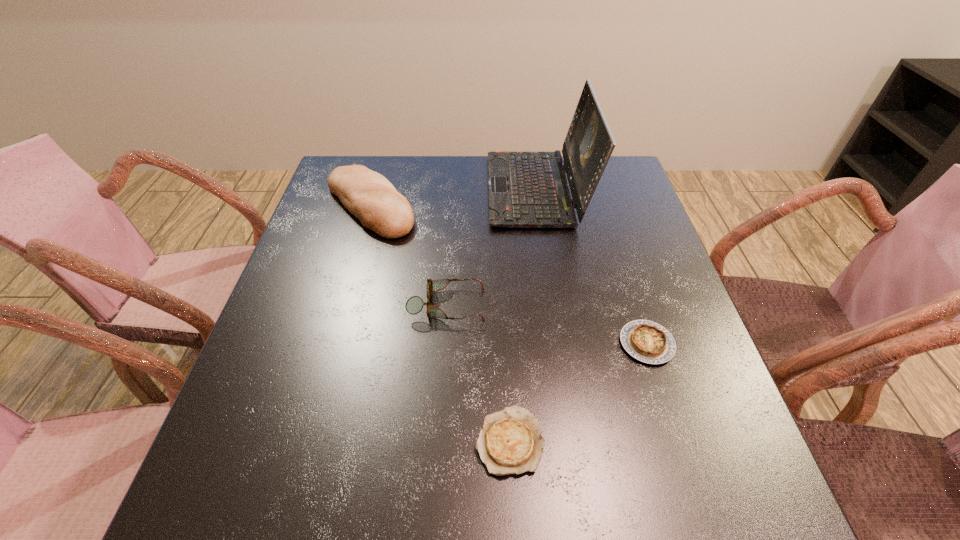
The image size is (960, 540). In order to click on vacant region that satisfies the following two spatial constraints: 1. on the front-facing side of the third tallest object; 2. on the back side of the shorter quiche in this screenshot , I will do `click(438, 441)`.

The width and height of the screenshot is (960, 540). What are the coordinates of `free spot that satisfies the following two spatial constraints: 1. on the screen of the tallest object; 2. on the front side of the shortest object` in the screenshot? It's located at click(x=575, y=441).